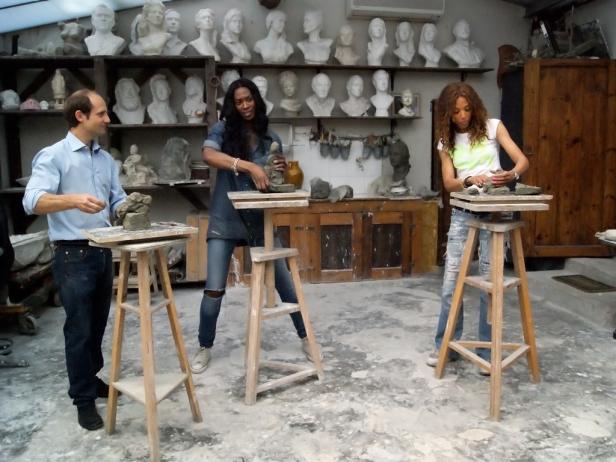
Locate an element on the screen. The image size is (616, 462). cabinet is located at coordinates pyautogui.click(x=411, y=222), pyautogui.click(x=328, y=242).